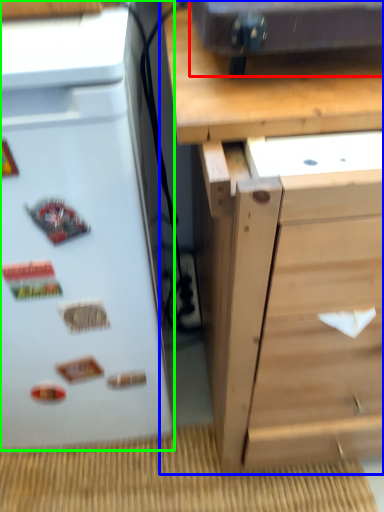
Question: Based on their relative distances, which object is nearer to appliance (highlighted by a red box)? Choose from chest of drawers (highlighted by a blue box) and refrigerator (highlighted by a green box).

Choices:
 (A) chest of drawers
 (B) refrigerator

Answer: (A)